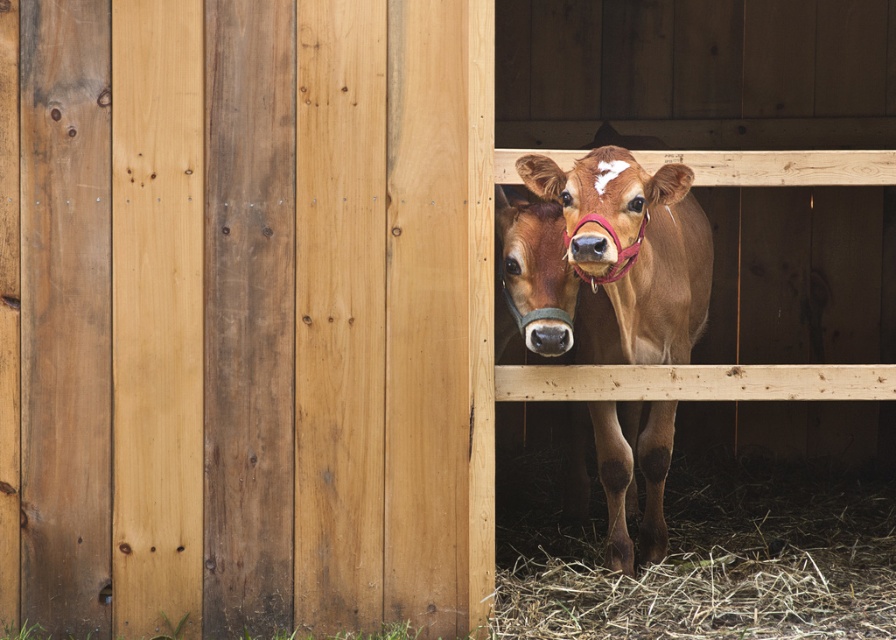
Can you confirm if natural wood barn door at center is wider than brown matte cow nose at center?

Yes, natural wood barn door at center is wider than brown matte cow nose at center.

Who is more forward, (x=33, y=48) or (x=573, y=237)?

Point (x=573, y=237) is more forward.

Locate an element on the screen. The height and width of the screenshot is (640, 896). natural wood barn door at center is located at coordinates (246, 316).

Does natural wood barn door at center appear on the right side of brown matte cow at center?

In fact, natural wood barn door at center is to the left of brown matte cow at center.

Does natural wood barn door at center have a greater height compared to brown matte cow at center?

Yes, natural wood barn door at center is taller than brown matte cow at center.

Consider the image. Who is more forward, (42, 525) or (537, 168)?

Positioned in front is point (537, 168).

You are a GUI agent. You are given a task and a screenshot of the screen. Output one action in this format:
    pyautogui.click(x=<x>, y=<y>)
    Task: Click on the natural wood barn door at center
    The height and width of the screenshot is (640, 896).
    Given the screenshot: What is the action you would take?
    pyautogui.click(x=246, y=316)

Does brown matte cow at center have a smaller size compared to brown matte cow nose at center?

Actually, brown matte cow at center might be larger than brown matte cow nose at center.

Does brown matte cow at center lie in front of brown matte cow nose at center?

No, it is not.

Is point (619, 326) farther from camera compared to point (605, 240)?

That is True.

Image resolution: width=896 pixels, height=640 pixels. What are the coordinates of `brown matte cow at center` in the screenshot? It's located at (632, 253).